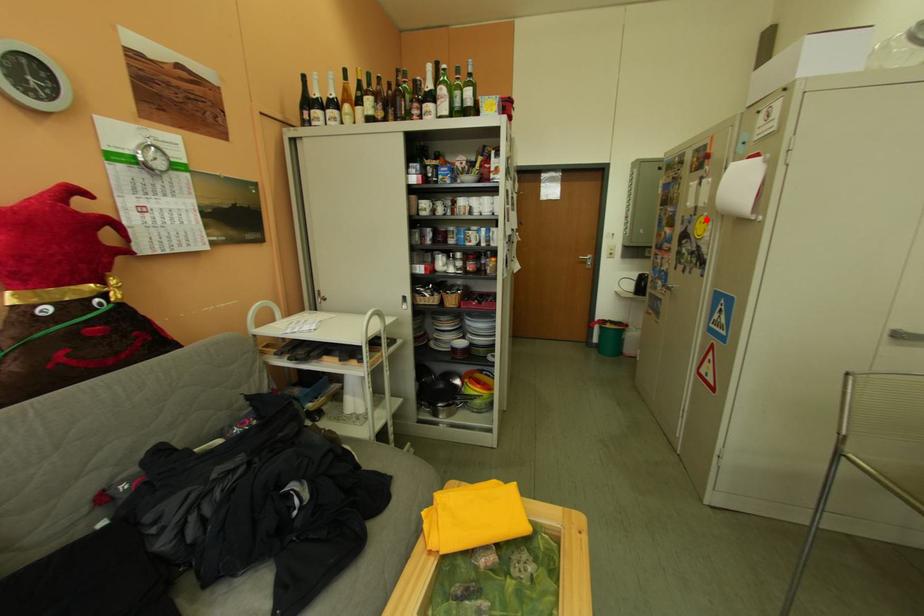
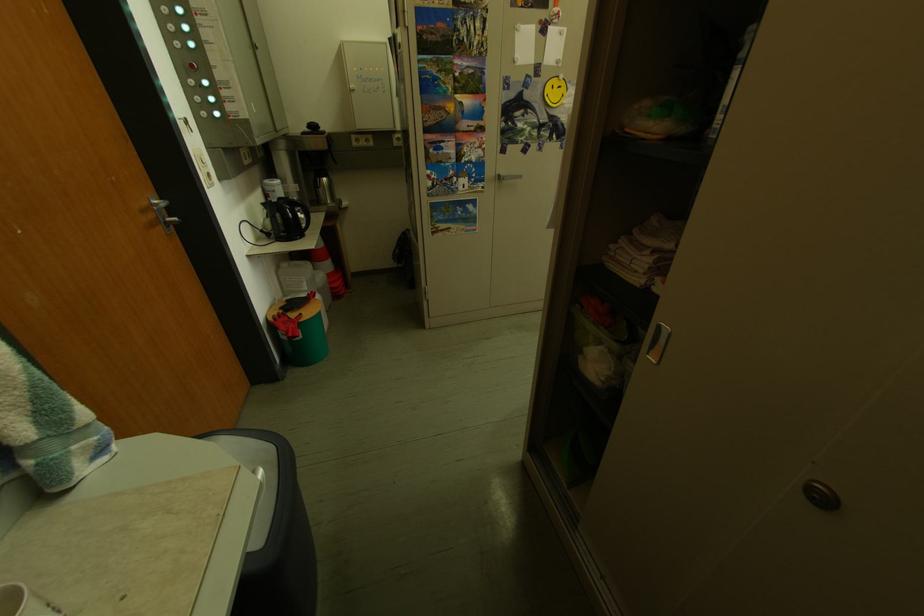
Find the pixel in the second image that matches the highlighted location in the first image.

(546, 82)